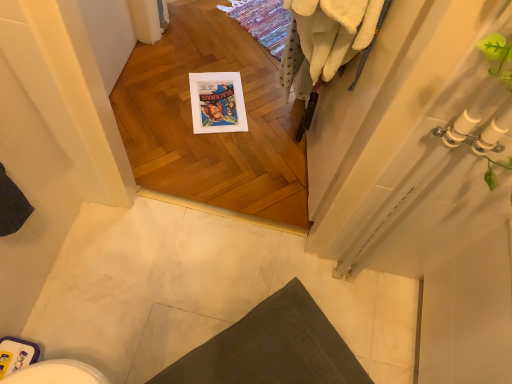
The image size is (512, 384). What are the coordinates of `vacant area situated below dark gray fabric bath mat at lower center (from a real-world perspective)` in the screenshot? It's located at (274, 354).